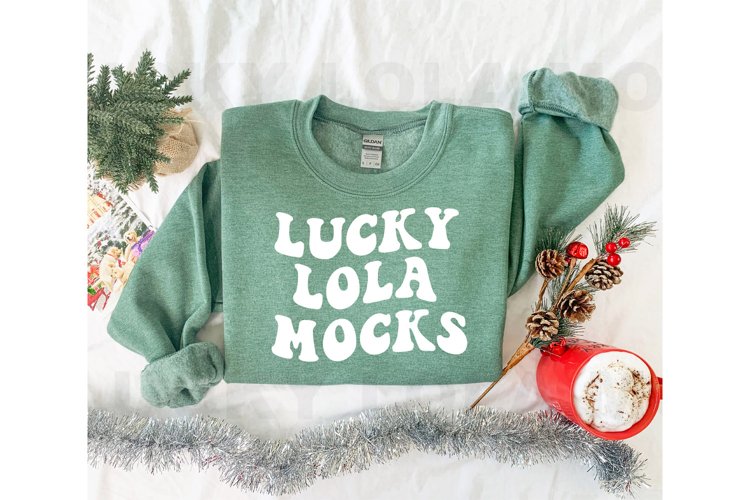
This screenshot has height=500, width=750. I want to click on small decorative tree, so click(x=124, y=112).